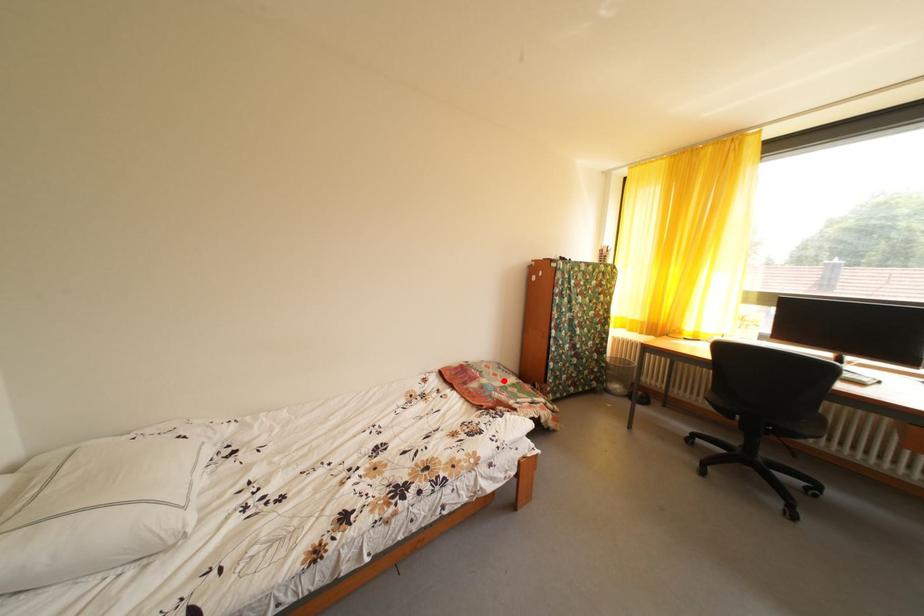
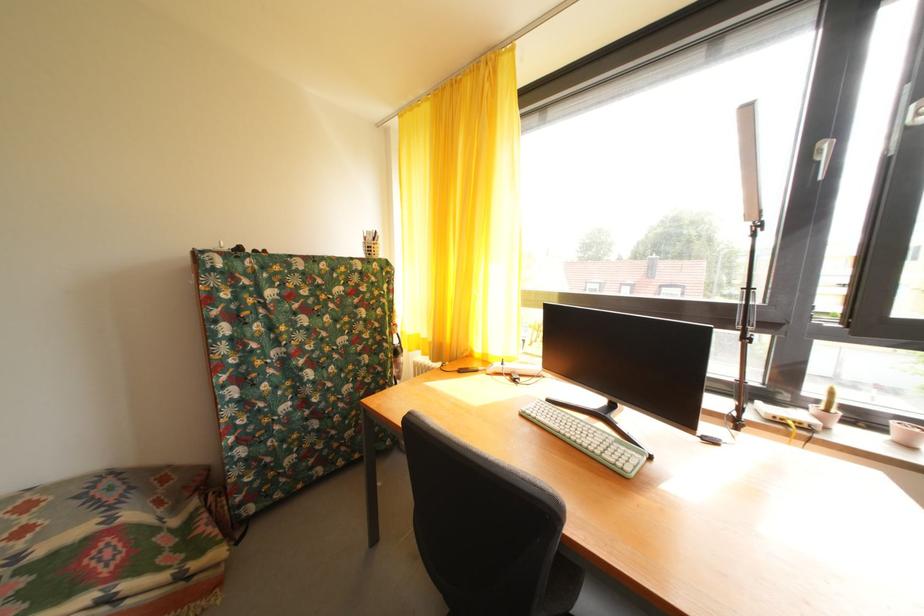
The point at the highlighted location is marked in the first image. Where is the corresponding point in the second image?

(31, 538)